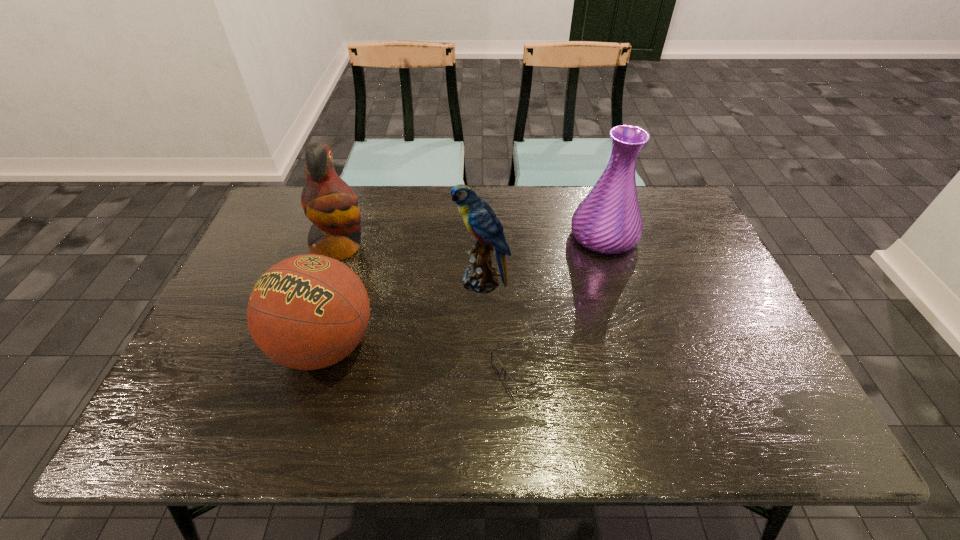
Identify the location of vacant space at the near left corner. The width and height of the screenshot is (960, 540). (223, 437).

In the image, there is a desktop. Where is `vacant space at the far right corner`? vacant space at the far right corner is located at coordinates (644, 208).

The image size is (960, 540). In the image, there is a desktop. In order to click on blank space at the near right corner in this screenshot , I will do `click(790, 439)`.

I want to click on vacant space in between the second shortest object and the shortest object, so click(x=421, y=359).

Where is `free space between the fourth tallest object and the spectacles`? This screenshot has width=960, height=540. free space between the fourth tallest object and the spectacles is located at coordinates (421, 359).

Locate an element on the screen. Image resolution: width=960 pixels, height=540 pixels. free space between the spectacles and the basketball is located at coordinates (421, 359).

What are the coordinates of `unoccupied position between the shortest object and the farther parrot` in the screenshot? It's located at (428, 310).

Where is `free area in between the spectacles and the farther parrot`? This screenshot has width=960, height=540. free area in between the spectacles and the farther parrot is located at coordinates (428, 310).

Where is `free space between the left parrot and the right parrot`? This screenshot has height=540, width=960. free space between the left parrot and the right parrot is located at coordinates (411, 265).

Where is `vacant point located between the third nearest object and the spectacles`? vacant point located between the third nearest object and the spectacles is located at coordinates (499, 326).